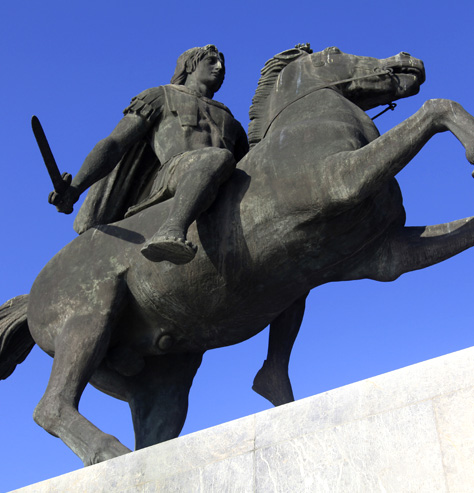
The image size is (474, 493). What are the coordinates of `left front leg of horse statue` in the screenshot? It's located at (448, 241).